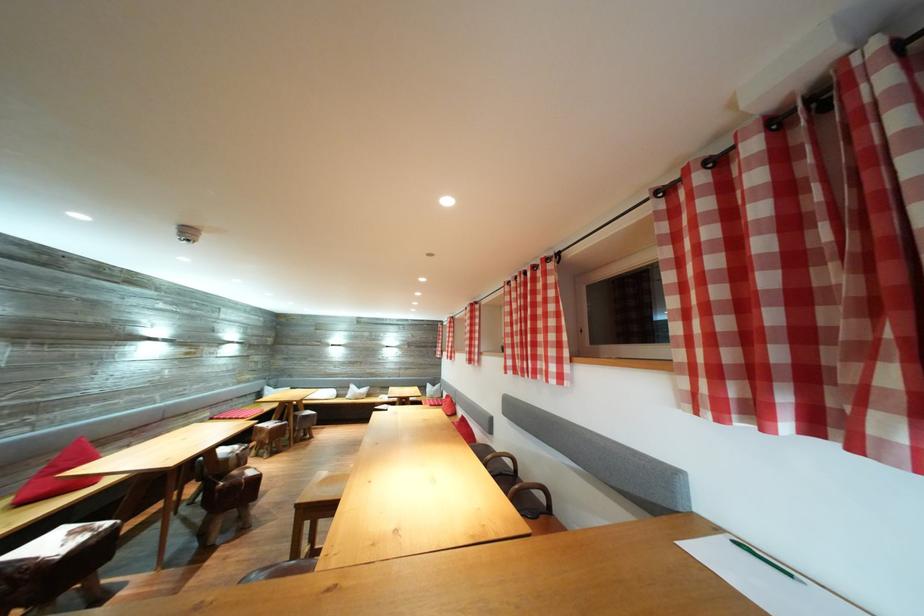
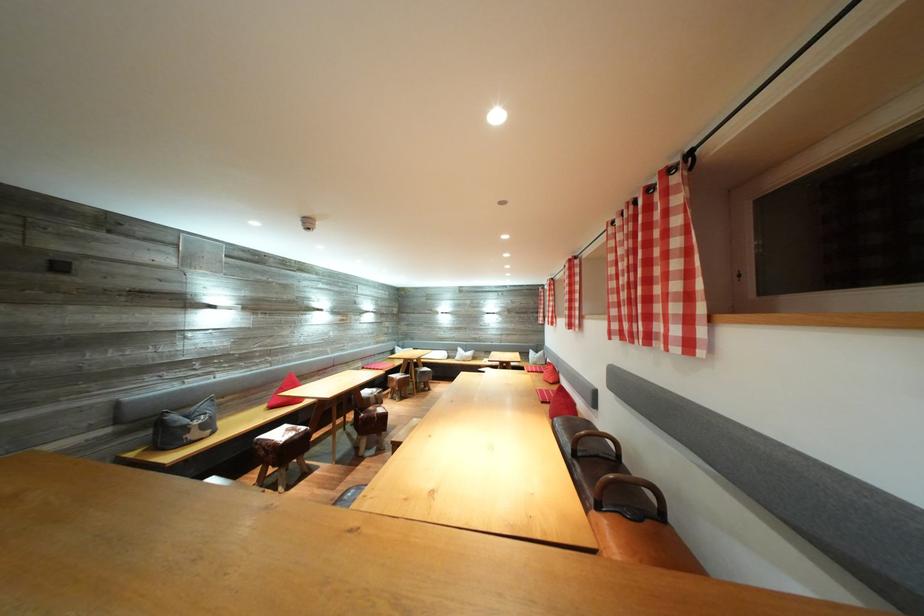
Find the pixel in the second image that matches (x=477, y=359) in the first image.

(578, 322)